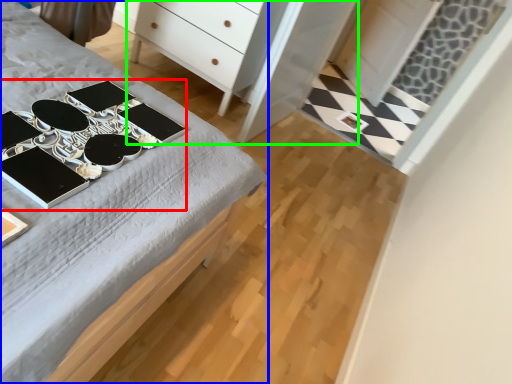
Question: Estimate the real-world distances between objects in this image. Which object is closer to changing table (highlighted by a red box), desk (highlighted by a blue box) or dresser (highlighted by a green box)?

Choices:
 (A) desk
 (B) dresser

Answer: (A)